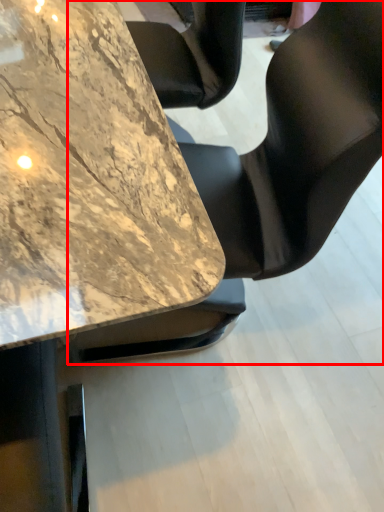
Question: From the image's perspective, where is chair (annotated by the red box) located in relation to table in the image?

Choices:
 (A) below
 (B) above

Answer: (A)